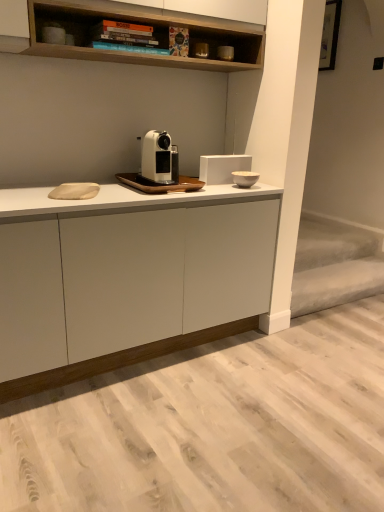
What do you see at coordinates (159, 159) in the screenshot? Image resolution: width=384 pixels, height=512 pixels. I see `white matte coffee machine at center` at bounding box center [159, 159].

What do you see at coordinates (225, 53) in the screenshot? I see `matte black coffee machine at upper center, the first appliance viewed from the top` at bounding box center [225, 53].

The image size is (384, 512). Find the location of `white ceramic bowl at upper right, placed as the 1th appliance when sorted from bottom to top`. white ceramic bowl at upper right, placed as the 1th appliance when sorted from bottom to top is located at coordinates (245, 178).

From the image's perspective, which object appears higher, white matte coffee machine at center or white matte cabinet at center?

From the image's view, white matte coffee machine at center is above.

Does white matte coffee machine at center turn towards white matte cabinet at center?

No, white matte coffee machine at center does not turn towards white matte cabinet at center.

Consider the image. Considering the relative sizes of white matte coffee machine at center and white matte cabinet at center in the image provided, is white matte coffee machine at center thinner than white matte cabinet at center?

Indeed, white matte coffee machine at center has a lesser width compared to white matte cabinet at center.

Is white matte coffee machine at center smaller than white matte cabinet at center?

Yes.

Looking at this image, would you say matte black coffee machine at upper center, which is the second appliance from bottom to top, is part of white matte coffee machine at center's contents?

No, matte black coffee machine at upper center, which is the second appliance from bottom to top, is located outside of white matte coffee machine at center.

From a real-world perspective, is white matte coffee machine at center over matte black coffee machine at upper center, the first appliance viewed from the top?

Actually, white matte coffee machine at center is physically below matte black coffee machine at upper center, the first appliance viewed from the top, in the real world.

Is point (167, 149) positioned after point (229, 56)?

No.

Considering the positions of points (230, 57) and (254, 177), is point (230, 57) farther from camera compared to point (254, 177)?

No, it is not.

Is matte black coffee machine at upper center, which is the second appliance from bottom to top, turned away from white ceramic bowl at upper right, placed as the 1th appliance when sorted from bottom to top?

No, matte black coffee machine at upper center, which is the second appliance from bottom to top, is not facing the opposite direction of white ceramic bowl at upper right, placed as the 1th appliance when sorted from bottom to top.

Can you tell me how much matte black coffee machine at upper center, the first appliance viewed from the top, and white ceramic bowl at upper right, placed as the 1th appliance when sorted from bottom to top, differ in facing direction?

0.00732 degrees separate the facing orientations of matte black coffee machine at upper center, the first appliance viewed from the top, and white ceramic bowl at upper right, placed as the 1th appliance when sorted from bottom to top.

Is matte black coffee machine at upper center, which is the second appliance from bottom to top, inside the boundaries of white ceramic bowl at upper right, placed as the 1th appliance when sorted from bottom to top, or outside?

matte black coffee machine at upper center, which is the second appliance from bottom to top, is outside white ceramic bowl at upper right, placed as the 1th appliance when sorted from bottom to top.

Can you confirm if white matte cabinet at center is thinner than matte black coffee machine at upper center, which is the second appliance from bottom to top?

No, white matte cabinet at center is not thinner than matte black coffee machine at upper center, which is the second appliance from bottom to top.

Consider the image. From the image's perspective, would you say white matte cabinet at center is positioned over matte black coffee machine at upper center, the first appliance viewed from the top?

No.

Considering the sizes of objects white matte cabinet at center and matte black coffee machine at upper center, the first appliance viewed from the top, in the image provided, who is shorter, white matte cabinet at center or matte black coffee machine at upper center, the first appliance viewed from the top,?

matte black coffee machine at upper center, the first appliance viewed from the top, is shorter.

In the image, is white ceramic bowl at upper right, which is counted as the second appliance, starting from the top, positioned in front of or behind matte black coffee machine at upper center, the first appliance viewed from the top?

Visually, white ceramic bowl at upper right, which is counted as the second appliance, starting from the top, is located in front of matte black coffee machine at upper center, the first appliance viewed from the top.

Based on the photo, from a real-world perspective, does white ceramic bowl at upper right, which is counted as the second appliance, starting from the top, sit lower than matte black coffee machine at upper center, which is the second appliance from bottom to top?

Yes, from a real-world perspective, white ceramic bowl at upper right, which is counted as the second appliance, starting from the top, is beneath matte black coffee machine at upper center, which is the second appliance from bottom to top.

Does point (233, 176) appear closer or farther from the camera than point (219, 55)?

Point (233, 176) appears to be farther away from the viewer than point (219, 55).

From their relative heights in the image, would you say white ceramic bowl at upper right, placed as the 1th appliance when sorted from bottom to top, is taller or shorter than matte black coffee machine at upper center, which is the second appliance from bottom to top?

Considering their sizes, white ceramic bowl at upper right, placed as the 1th appliance when sorted from bottom to top, has less height than matte black coffee machine at upper center, which is the second appliance from bottom to top.

From a real-world perspective, is white matte cabinet at center located higher than white ceramic bowl at upper right, placed as the 1th appliance when sorted from bottom to top?

Actually, white matte cabinet at center is physically below white ceramic bowl at upper right, placed as the 1th appliance when sorted from bottom to top, in the real world.

Is white matte cabinet at center looking in the opposite direction of white ceramic bowl at upper right, placed as the 1th appliance when sorted from bottom to top?

No.

How many degrees apart are the facing directions of white matte cabinet at center and white ceramic bowl at upper right, placed as the 1th appliance when sorted from bottom to top?

0.00112 degrees.

From the image's perspective, which object appears higher, white matte cabinet at center or white ceramic bowl at upper right, placed as the 1th appliance when sorted from bottom to top?

From the image's view, white ceramic bowl at upper right, placed as the 1th appliance when sorted from bottom to top, is above.

Does matte black coffee machine at upper center, the first appliance viewed from the top, have a greater height compared to white matte cabinet at center?

Incorrect, the height of matte black coffee machine at upper center, the first appliance viewed from the top, is not larger of that of white matte cabinet at center.

Is matte black coffee machine at upper center, the first appliance viewed from the top, turned away from white matte cabinet at center?

That's not correct — matte black coffee machine at upper center, the first appliance viewed from the top, is not looking away from white matte cabinet at center.

From a real-world perspective, is matte black coffee machine at upper center, the first appliance viewed from the top, on top of white matte cabinet at center?

Yes.

Consider the image. Are matte black coffee machine at upper center, the first appliance viewed from the top, and white matte cabinet at center beside each other?

No, matte black coffee machine at upper center, the first appliance viewed from the top, is not next to white matte cabinet at center.

In order to click on cabinetry below the white matte coffee machine at center (from a real-world perspective) in this screenshot , I will do `click(127, 277)`.

You are a GUI agent. You are given a task and a screenshot of the screen. Output one action in this format:
    pyautogui.click(x=<x>, y=<y>)
    Task: Click on the appliance above the white matte coffee machine at center (from the image's perspective)
    This screenshot has height=512, width=384.
    Given the screenshot: What is the action you would take?
    pyautogui.click(x=225, y=53)

Which object lies nearer to the anchor point white ceramic bowl at upper right, which is counted as the second appliance, starting from the top, matte black coffee machine at upper center, which is the second appliance from bottom to top, or white matte cabinet at center?

Among the two, matte black coffee machine at upper center, which is the second appliance from bottom to top, is located nearer to white ceramic bowl at upper right, which is counted as the second appliance, starting from the top.

When comparing their distances from white ceramic bowl at upper right, placed as the 1th appliance when sorted from bottom to top, does white matte coffee machine at center or matte black coffee machine at upper center, the first appliance viewed from the top, seem closer?

Based on the image, white matte coffee machine at center appears to be nearer to white ceramic bowl at upper right, placed as the 1th appliance when sorted from bottom to top.

Looking at the image, which one is located closer to white matte cabinet at center, white matte coffee machine at center or white ceramic bowl at upper right, which is counted as the second appliance, starting from the top?

white matte coffee machine at center is positioned closer to the anchor white matte cabinet at center.

Based on the photo, from the image, which object appears to be farther from white matte coffee machine at center, white ceramic bowl at upper right, placed as the 1th appliance when sorted from bottom to top, or matte black coffee machine at upper center, the first appliance viewed from the top?

The object further to white matte coffee machine at center is matte black coffee machine at upper center, the first appliance viewed from the top.

Considering their positions, is matte black coffee machine at upper center, the first appliance viewed from the top, positioned further to white matte coffee machine at center than white matte cabinet at center?

matte black coffee machine at upper center, the first appliance viewed from the top, is positioned further to the anchor white matte coffee machine at center.

From the image, which object appears to be nearer to matte black coffee machine at upper center, which is the second appliance from bottom to top, white ceramic bowl at upper right, which is counted as the second appliance, starting from the top, or white matte cabinet at center?

white ceramic bowl at upper right, which is counted as the second appliance, starting from the top, is positioned closer to the anchor matte black coffee machine at upper center, which is the second appliance from bottom to top.

Based on their spatial positions, is white ceramic bowl at upper right, which is counted as the second appliance, starting from the top, or matte black coffee machine at upper center, the first appliance viewed from the top, closer to white matte cabinet at center?

Based on the image, white ceramic bowl at upper right, which is counted as the second appliance, starting from the top, appears to be nearer to white matte cabinet at center.

Which object lies further to the anchor point matte black coffee machine at upper center, which is the second appliance from bottom to top, white matte cabinet at center or white matte coffee machine at center?

white matte cabinet at center lies further to matte black coffee machine at upper center, which is the second appliance from bottom to top, than the other object.

The height and width of the screenshot is (512, 384). I want to click on home appliance between matte black coffee machine at upper center, the first appliance viewed from the top, and white ceramic bowl at upper right, which is counted as the second appliance, starting from the top, from top to bottom, so click(159, 159).

Identify the location of appliance between matte black coffee machine at upper center, the first appliance viewed from the top, and white matte cabinet at center, in the vertical direction. (245, 178).

Identify the location of home appliance located between white matte cabinet at center and white ceramic bowl at upper right, placed as the 1th appliance when sorted from bottom to top, in the depth direction. This screenshot has width=384, height=512. (159, 159).

Where is `home appliance between matte black coffee machine at upper center, the first appliance viewed from the top, and white matte cabinet at center from top to bottom`? The height and width of the screenshot is (512, 384). home appliance between matte black coffee machine at upper center, the first appliance viewed from the top, and white matte cabinet at center from top to bottom is located at coordinates (159, 159).